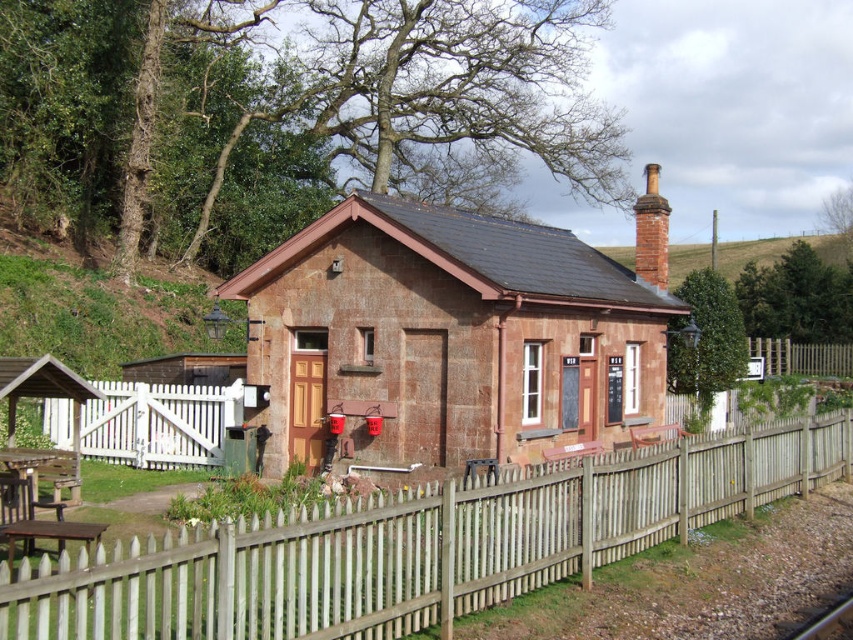
Can you confirm if wooden picket fence at center is wider than brown wooden fence at right?

Incorrect, wooden picket fence at center's width does not surpass brown wooden fence at right's.

You are a GUI agent. You are given a task and a screenshot of the screen. Output one action in this format:
    pyautogui.click(x=<x>, y=<y>)
    Task: Click on the wooden picket fence at center
    The image size is (853, 640).
    Given the screenshot: What is the action you would take?
    pyautogui.click(x=416, y=545)

Locate an element on the screen. Image resolution: width=853 pixels, height=640 pixels. wooden picket fence at center is located at coordinates (416, 545).

Looking at this image, is rustic stone hut at center closer to the viewer compared to brown wooden fence at right?

Yes, rustic stone hut at center is closer to the viewer.

Is point (401, 384) farther from camera compared to point (772, 344)?

No.

This screenshot has height=640, width=853. Find the location of `rustic stone hut at center`. rustic stone hut at center is located at coordinates (445, 337).

Does point (376, 305) come closer to viewer compared to point (161, 454)?

Yes, point (376, 305) is closer to viewer.

Can you confirm if rustic stone hut at center is wider than white wooden fence at lower left?

Yes, rustic stone hut at center is wider than white wooden fence at lower left.

Describe the element at coordinates (445, 337) in the screenshot. This screenshot has height=640, width=853. I see `rustic stone hut at center` at that location.

This screenshot has height=640, width=853. Identify the location of rustic stone hut at center. (445, 337).